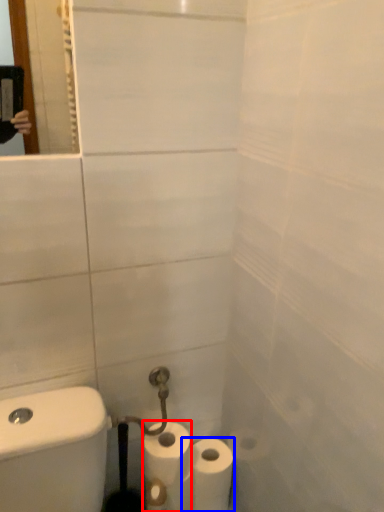
Question: Which object is closer to the camera taking this photo, toilet paper (highlighted by a red box) or toilet paper (highlighted by a blue box)?

Choices:
 (A) toilet paper
 (B) toilet paper

Answer: (A)